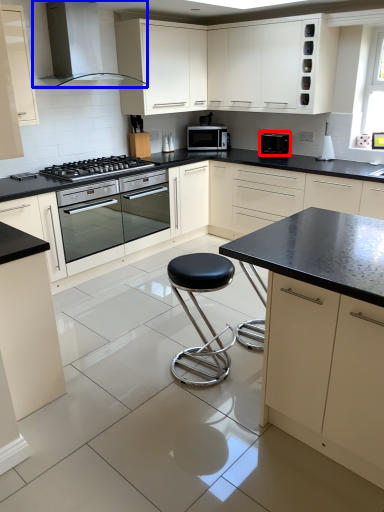
Question: Which object is closer to the camera taking this photo, kitchen appliance (highlighted by a red box) or home appliance (highlighted by a blue box)?

Choices:
 (A) kitchen appliance
 (B) home appliance

Answer: (B)